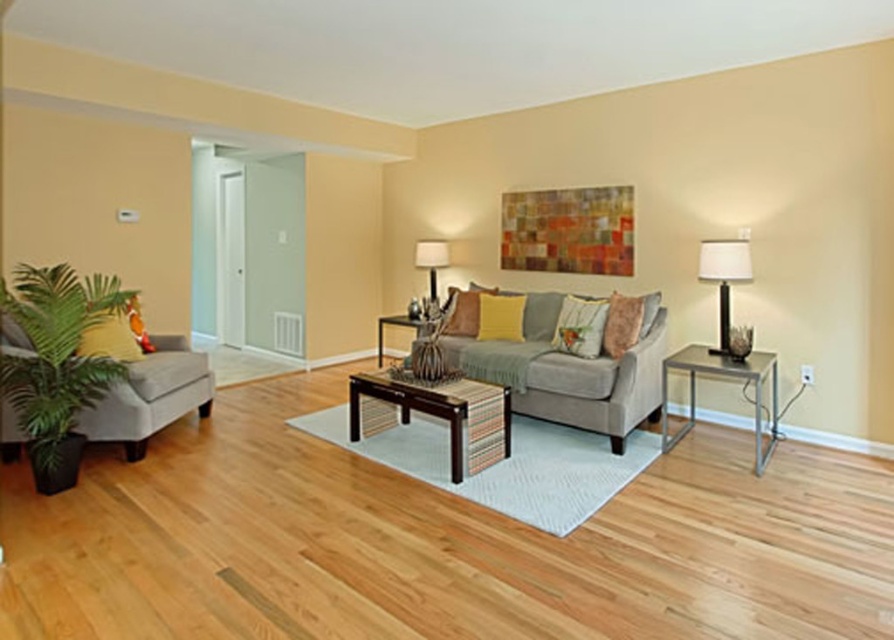
Question: Among these objects, which one is farthest from the camera?

Choices:
 (A) matte glass table lamp at center
 (B) green leafy plant at left
 (C) gray fabric couch at center
 (D) white fabric lampshade at right

Answer: (A)

Question: Is gray fabric couch at center to the right of metallic silver side table at right from the viewer's perspective?

Choices:
 (A) no
 (B) yes

Answer: (A)

Question: Does dark brown wood coffee table at center appear over white fabric lampshade at right?

Choices:
 (A) yes
 (B) no

Answer: (B)

Question: Which point is farther to the camera?

Choices:
 (A) matte glass table lamp at center
 (B) dark brown wood coffee table at center

Answer: (A)

Question: Does green leafy plant at left appear over wooden coffee table at center?

Choices:
 (A) yes
 (B) no

Answer: (B)

Question: Estimate the real-world distances between objects in this image. Which object is farther from the white fabric lampshade at right?

Choices:
 (A) gray fabric couch at center
 (B) matte glass table lamp at center
 (C) dark brown wood coffee table at center
 (D) wooden coffee table at center

Answer: (B)